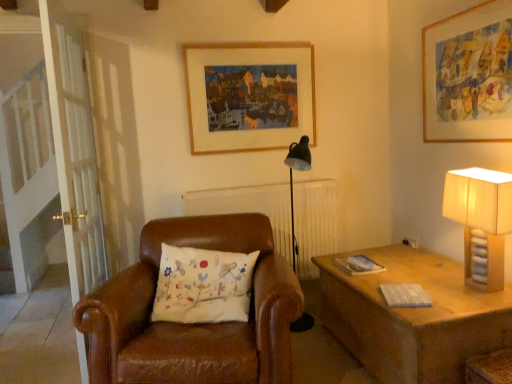
Where is `free point above wooden picture frame at upper center, which is the 1th picture frame in left-to-right order (from a real-world perspective)`? This screenshot has height=384, width=512. free point above wooden picture frame at upper center, which is the 1th picture frame in left-to-right order (from a real-world perspective) is located at coordinates (244, 47).